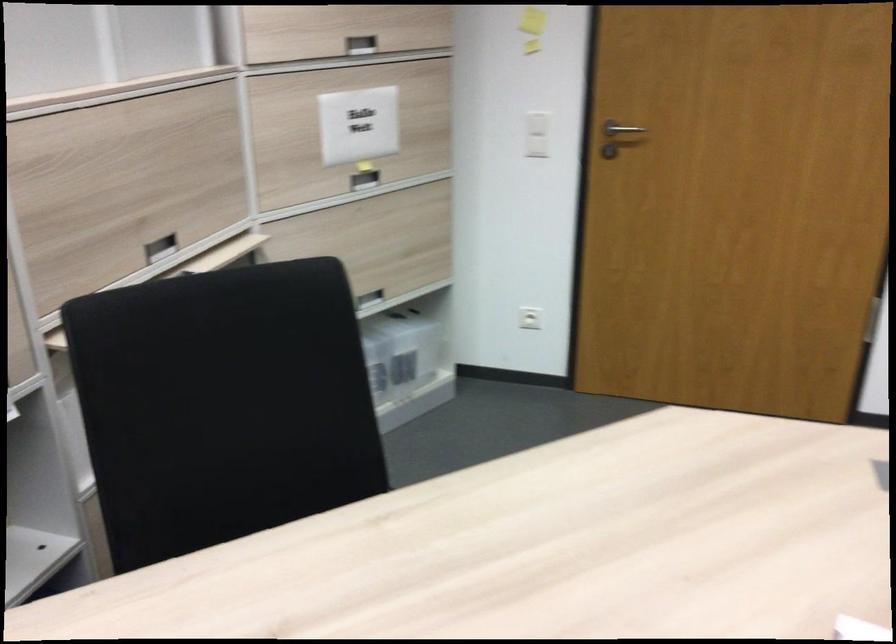
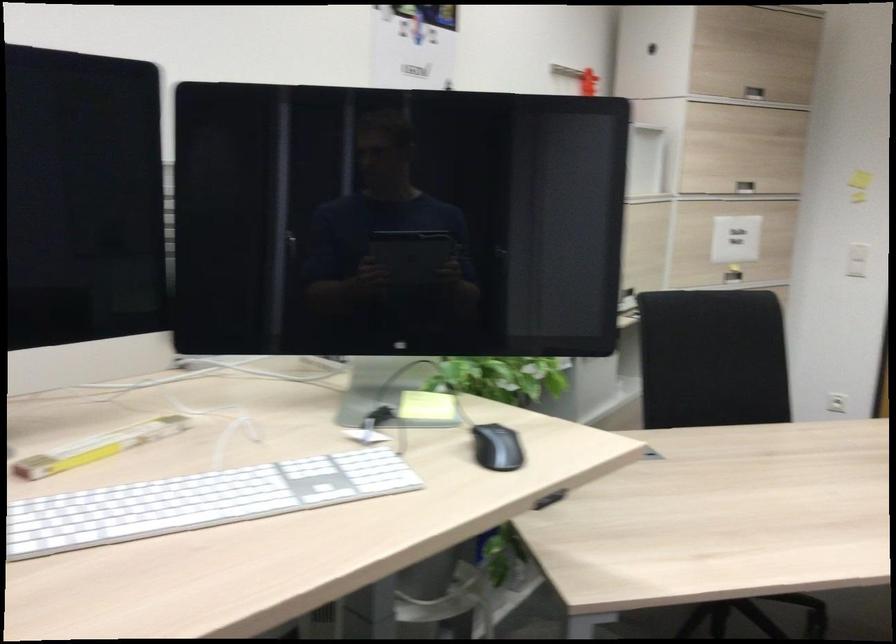
The images are taken continuously from a first-person perspective. In which direction are you moving?

The cameraman walked toward left, backward.